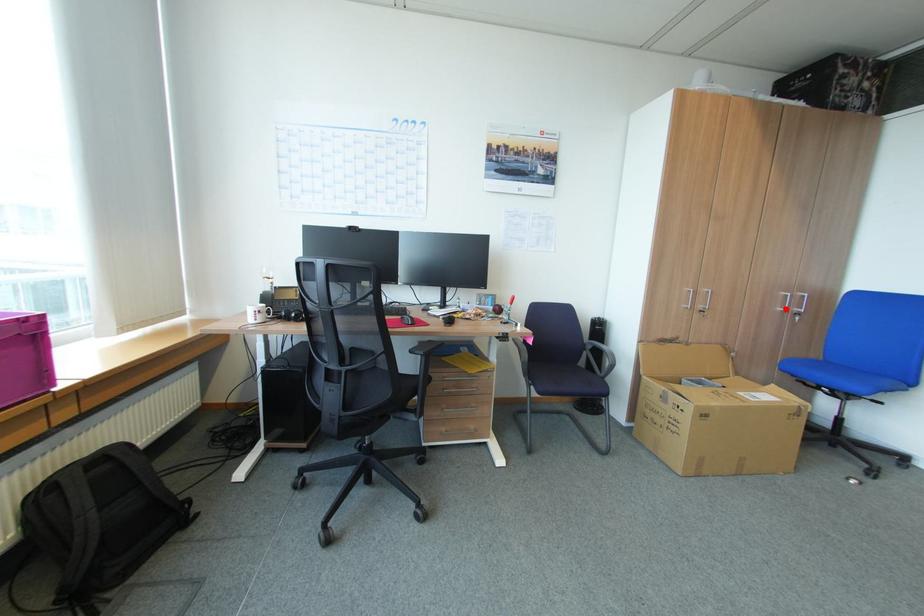
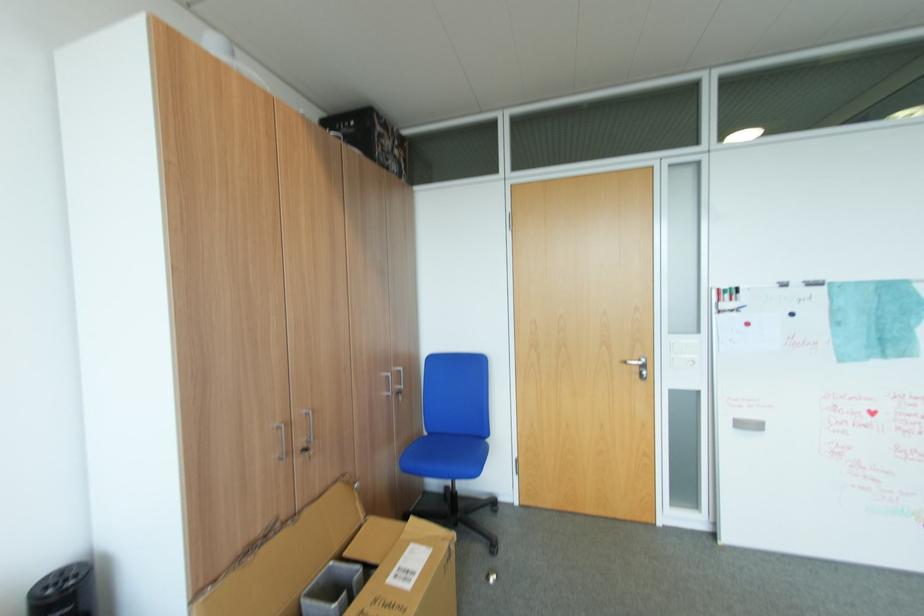
Question: I am providing you with two images of the same scene from different viewpoints. Image1 has a red point marked. In image2, the corresponding 3D location appears at what relative position? Reply with the corresponding letter.

Choices:
 (A) Closer
 (B) Farther

Answer: (B)